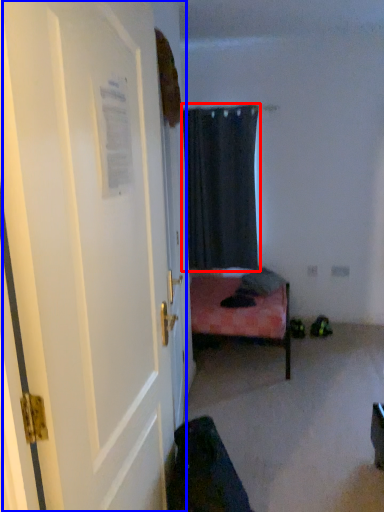
Question: Which object appears farthest to the camera in this image, curtain (highlighted by a red box) or door (highlighted by a blue box)?

Choices:
 (A) curtain
 (B) door

Answer: (A)